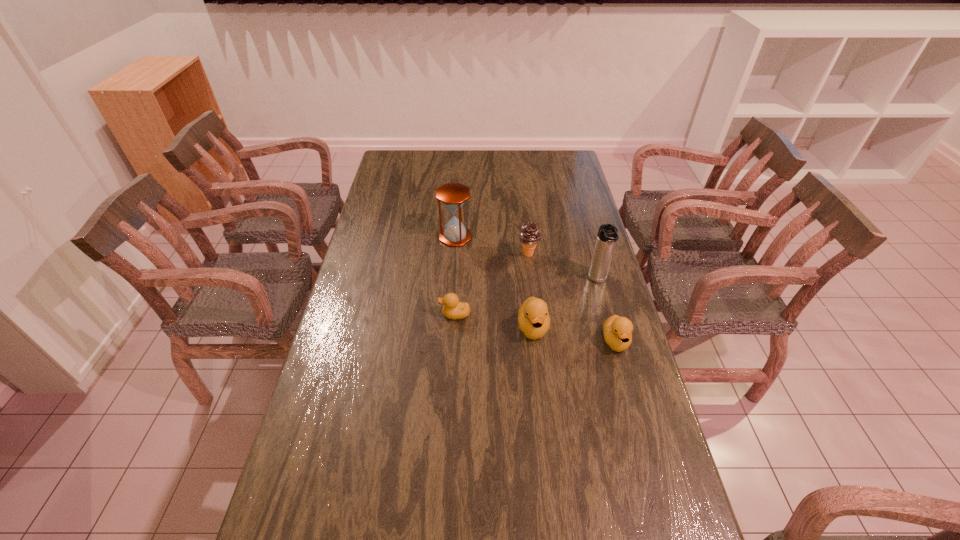
I want to click on the shortest duckling, so click(x=453, y=309).

At what (x,y) coordinates should I click in order to perform the action: click on the leftmost duckling. Please return your answer as a coordinate pair (x, y). The height and width of the screenshot is (540, 960). Looking at the image, I should click on (453, 309).

At what (x,y) coordinates should I click in order to perform the action: click on the third shortest object. Please return your answer as a coordinate pair (x, y). The width and height of the screenshot is (960, 540). Looking at the image, I should click on (533, 318).

Where is `the tallest duckling`? The width and height of the screenshot is (960, 540). the tallest duckling is located at coordinates (533, 318).

Identify the location of the rightmost duckling. The height and width of the screenshot is (540, 960). (617, 330).

This screenshot has width=960, height=540. What are the coordinates of `the second shortest object` in the screenshot? It's located at (617, 330).

Image resolution: width=960 pixels, height=540 pixels. Identify the location of the second farthest object. (x=529, y=236).

The width and height of the screenshot is (960, 540). Identify the location of hourglass. (453, 195).

You are a GUI agent. You are given a task and a screenshot of the screen. Output one action in this format:
    pyautogui.click(x=<x>, y=<y>)
    Task: Click on the third farthest object
    The width and height of the screenshot is (960, 540).
    Given the screenshot: What is the action you would take?
    pyautogui.click(x=607, y=236)

Find the location of a particular element. This screenshot has height=540, width=960. free space located 0.290m on the face of the leftmost duckling is located at coordinates (350, 314).